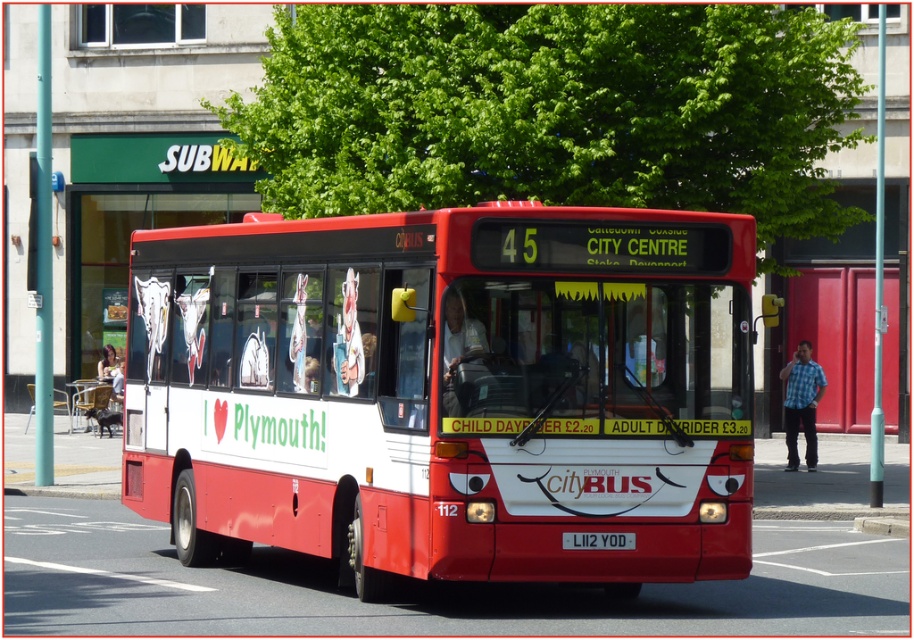
Does matte red bus at center lie behind blue plaid shirt at right?

No, it is not.

Which is above, matte red bus at center or blue plaid shirt at right?

matte red bus at center is above.

The image size is (914, 640). I want to click on matte red bus at center, so click(448, 392).

Which is more to the right, blue plaid shirt at right or white plastic license plate at center?

From the viewer's perspective, blue plaid shirt at right appears more on the right side.

Which is in front, point (781, 371) or point (588, 538)?

Point (588, 538) is in front.

Is point (787, 380) closer to camera compared to point (581, 540)?

No.

Locate an element on the screen. This screenshot has width=914, height=640. blue plaid shirt at right is located at coordinates (801, 403).

Consider the image. Is matte red bus at center wider than white plastic license plate at center?

Indeed, matte red bus at center has a greater width compared to white plastic license plate at center.

Based on the photo, between matte red bus at center and white plastic license plate at center, which one is positioned lower?

white plastic license plate at center is below.

Is point (629, 554) positioned behind point (575, 547)?

Yes.

Locate an element on the screen. The image size is (914, 640). matte red bus at center is located at coordinates (448, 392).